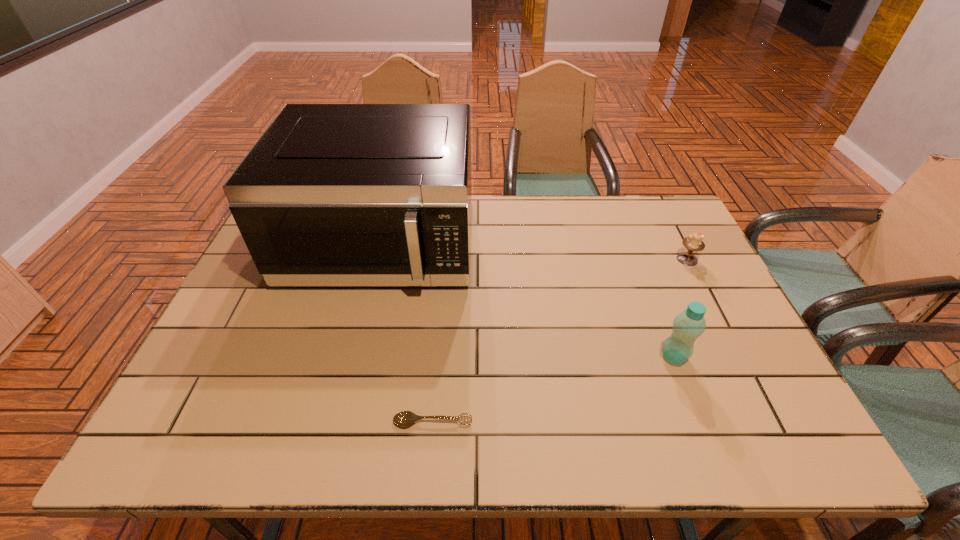
Locate an element on the screen. free space between the shortest object and the tallest object is located at coordinates (407, 333).

At what (x,y) coordinates should I click in order to perform the action: click on object that stands as the closest to the second object from right to left. Please return your answer as a coordinate pair (x, y). Looking at the image, I should click on (693, 242).

Locate which object ranks third in proximity to the candle holder. Please provide its 2D coordinates. Your answer should be formatted as a tuple, i.e. [(x, y)], where the tuple contains the x and y coordinates of a point satisfying the conditions above.

[(404, 418)]

Find the location of a particular element. free space that satisfies the following two spatial constraints: 1. on the back side of the shortest object; 2. on the left side of the third tallest object is located at coordinates (446, 259).

The width and height of the screenshot is (960, 540). I want to click on vacant area in the image that satisfies the following two spatial constraints: 1. on the back side of the second tallest object; 2. on the left side of the shortest object, so click(439, 357).

The height and width of the screenshot is (540, 960). I want to click on blank space that satisfies the following two spatial constraints: 1. on the back side of the shortest object; 2. on the left side of the second nearest object, so click(439, 357).

Identify the location of vacant space that satisfies the following two spatial constraints: 1. on the front-facing side of the shortest object; 2. on the left side of the tallest object. click(337, 421).

Where is `vacant space that satisfies the following two spatial constraints: 1. on the front-facing side of the third object from left to right; 2. on the right side of the tallest object`? This screenshot has width=960, height=540. vacant space that satisfies the following two spatial constraints: 1. on the front-facing side of the third object from left to right; 2. on the right side of the tallest object is located at coordinates (353, 357).

The width and height of the screenshot is (960, 540). I want to click on free spot that satisfies the following two spatial constraints: 1. on the front-facing side of the microwave_oven; 2. on the left side of the candle holder, so click(377, 259).